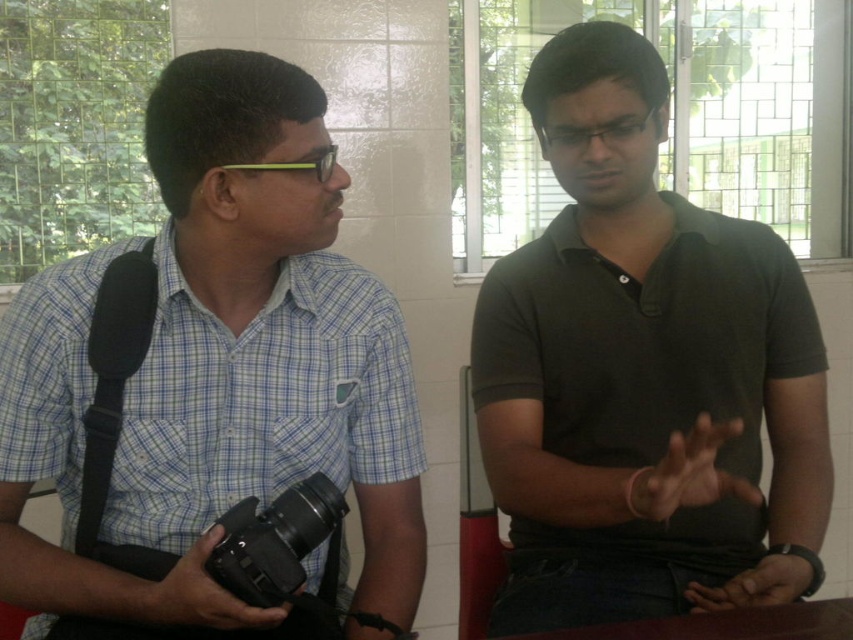
Between point (636, 528) and point (270, 552), which one is positioned in front?

Positioned in front is point (270, 552).

Can you confirm if dark green polo shirt at center is thinner than matte black camera at lower left?

Incorrect, dark green polo shirt at center's width is not less than matte black camera at lower left's.

Which is behind, point (477, 349) or point (276, 560)?

Point (477, 349)

Locate an element on the screen. dark green polo shirt at center is located at coordinates (643, 374).

Who is positioned more to the left, blue checkered shirt at left or dark green polo shirt at center?

blue checkered shirt at left is more to the left.

The image size is (853, 640). Describe the element at coordinates (212, 387) in the screenshot. I see `blue checkered shirt at left` at that location.

Image resolution: width=853 pixels, height=640 pixels. What do you see at coordinates (212, 387) in the screenshot?
I see `blue checkered shirt at left` at bounding box center [212, 387].

I want to click on blue checkered shirt at left, so click(x=212, y=387).

Can you confirm if blue checkered shirt at left is bigger than matte black camera at lower left?

Yes.

Describe the element at coordinates (212, 387) in the screenshot. I see `blue checkered shirt at left` at that location.

You are a GUI agent. You are given a task and a screenshot of the screen. Output one action in this format:
    pyautogui.click(x=<x>, y=<y>)
    Task: Click on the blue checkered shirt at left
    Image resolution: width=853 pixels, height=640 pixels.
    Given the screenshot: What is the action you would take?
    click(x=212, y=387)